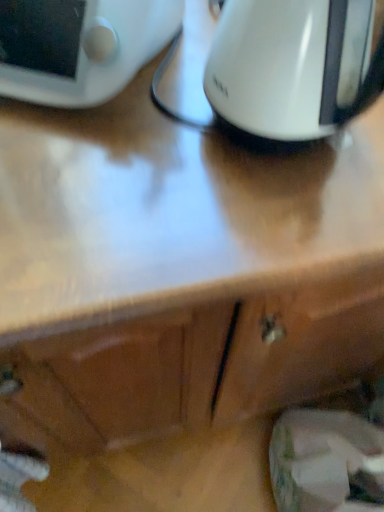
Identify the location of free space to the left of white glossy kettle at upper center. (140, 147).